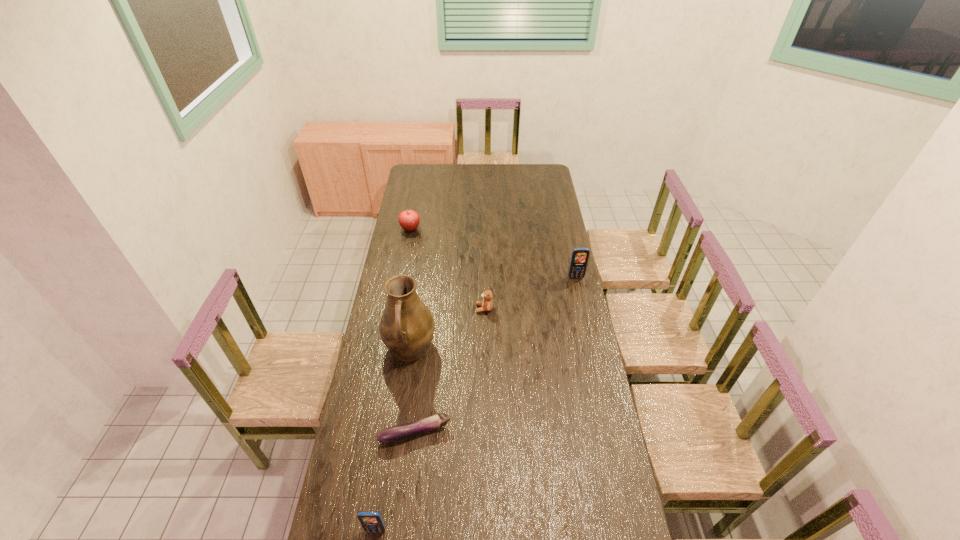
What are the coordinates of `the second object from right to left` in the screenshot? It's located at (487, 304).

The height and width of the screenshot is (540, 960). I want to click on vacant region located 0.100m on the screen of the fifth shortest object, so click(x=580, y=294).

Where is `free space located on the right of the apple`? This screenshot has height=540, width=960. free space located on the right of the apple is located at coordinates (469, 229).

Where is `blank area located on the handle side of the fourth farthest object`? The height and width of the screenshot is (540, 960). blank area located on the handle side of the fourth farthest object is located at coordinates (401, 411).

Find the location of a particular element. free space located 0.200m on the front of the shortest object is located at coordinates (407, 508).

Identify the location of free space located 0.090m on the front-facing side of the teddy bear. (456, 308).

The image size is (960, 540). I want to click on free space located on the front-facing side of the teddy bear, so click(x=419, y=308).

Find the location of a particular element. This screenshot has width=960, height=540. vacant space located on the front-facing side of the teddy bear is located at coordinates (443, 308).

Identify the location of object that is at the near edge. (371, 521).

The image size is (960, 540). Identify the location of cellular telephone at the left edge. (371, 521).